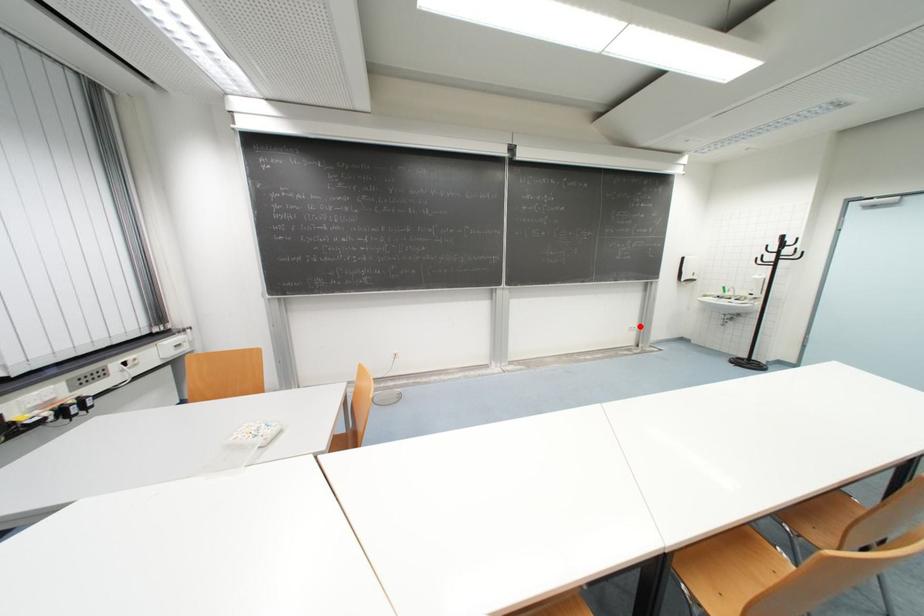
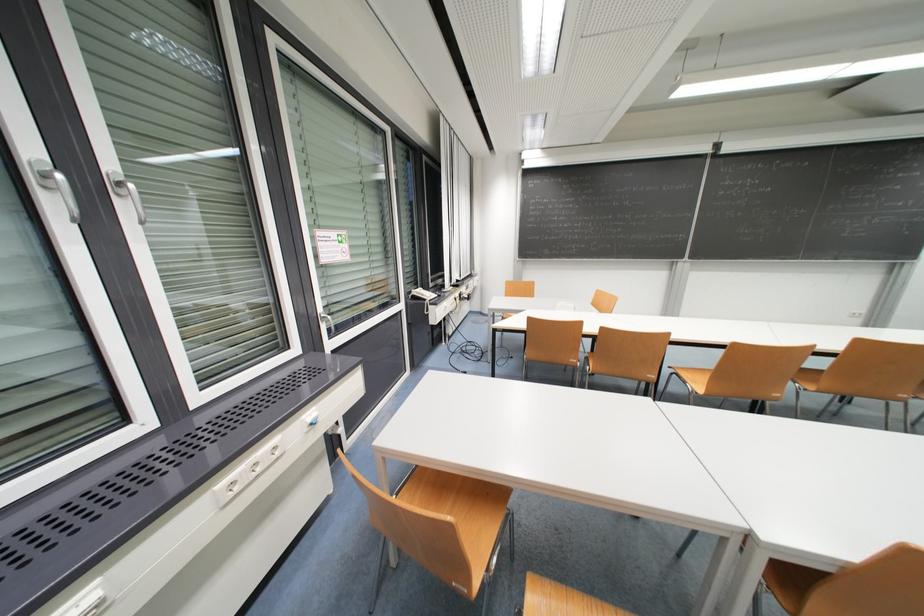
The point at the highlighted location is marked in the first image. Where is the corresponding point in the second image?

(869, 313)